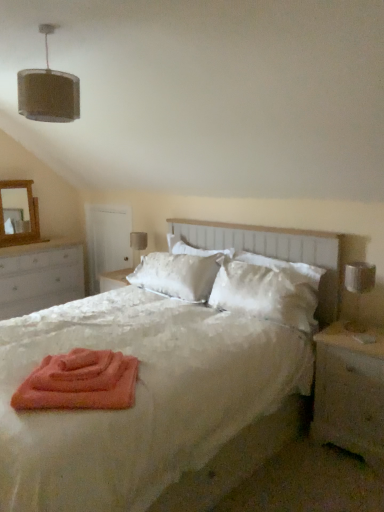
Question: From a real-world perspective, is wooden nightstand at right, which is the first nightstand from right to left, located higher than white satin bed at center?

Choices:
 (A) yes
 (B) no

Answer: (B)

Question: Considering the relative positions of wooden nightstand at right, marked as the 2th nightstand in a left-to-right arrangement, and white satin bed at center in the image provided, is wooden nightstand at right, marked as the 2th nightstand in a left-to-right arrangement, behind white satin bed at center?

Choices:
 (A) no
 (B) yes

Answer: (B)

Question: From a real-world perspective, is wooden nightstand at right, marked as the 2th nightstand in a left-to-right arrangement, physically below white satin bed at center?

Choices:
 (A) no
 (B) yes

Answer: (B)

Question: Is wooden nightstand at right, which is the 1th nightstand from front to back, smaller than white satin bed at center?

Choices:
 (A) no
 (B) yes

Answer: (B)

Question: Is wooden nightstand at right, which is the first nightstand from right to left, located outside white satin bed at center?

Choices:
 (A) yes
 (B) no

Answer: (A)

Question: Can you confirm if wooden nightstand at right, which is the first nightstand from right to left, is thinner than white satin bed at center?

Choices:
 (A) no
 (B) yes

Answer: (B)

Question: Considering the relative sizes of white satin headboard at center and satin white pillow at center in the image provided, is white satin headboard at center bigger than satin white pillow at center?

Choices:
 (A) yes
 (B) no

Answer: (A)

Question: Is white satin headboard at center smaller than satin white pillow at center?

Choices:
 (A) yes
 (B) no

Answer: (B)

Question: Is white satin headboard at center to the right of satin white pillow at center from the viewer's perspective?

Choices:
 (A) no
 (B) yes

Answer: (A)

Question: Is there a large distance between white satin headboard at center and satin white pillow at center?

Choices:
 (A) yes
 (B) no

Answer: (B)

Question: Is the position of white satin headboard at center less distant than that of satin white pillow at center?

Choices:
 (A) yes
 (B) no

Answer: (A)

Question: Considering the relative sizes of white satin headboard at center and satin white pillow at center in the image provided, is white satin headboard at center taller than satin white pillow at center?

Choices:
 (A) no
 (B) yes

Answer: (B)

Question: Does satin white pillow at center have a larger size compared to brown fabric lampshade at upper left?

Choices:
 (A) yes
 (B) no

Answer: (A)